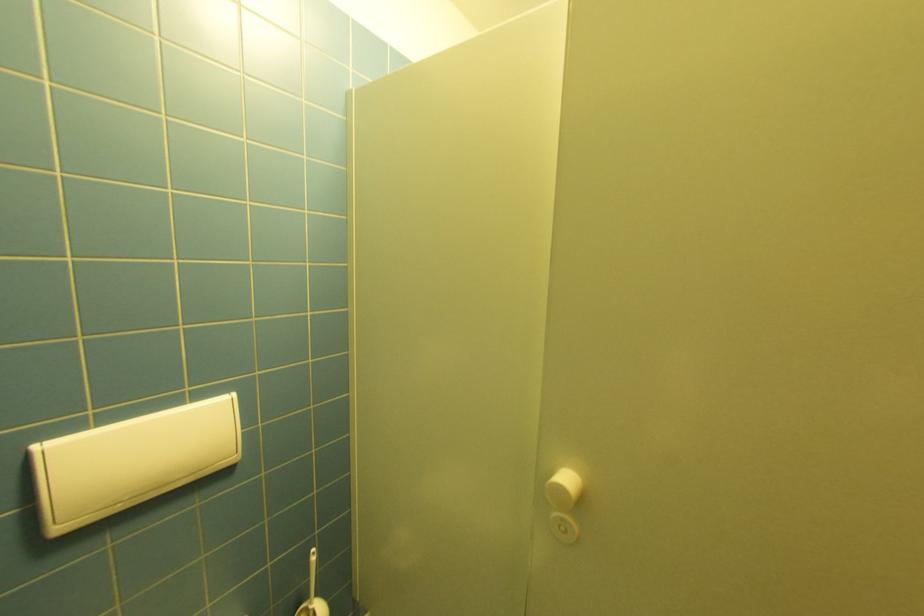
I want to click on white door lock, so click(x=130, y=461).